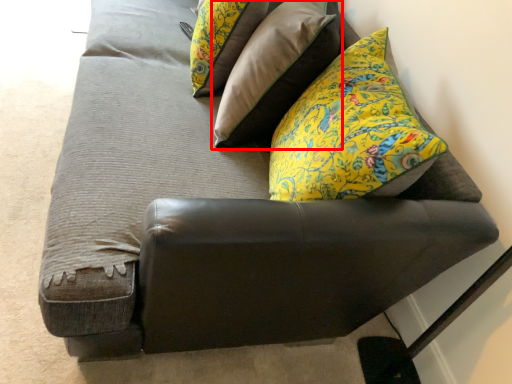
Question: From the image, what is the correct spatial relationship of pillow (annotated by the red box) in relation to pillow?

Choices:
 (A) right
 (B) left

Answer: (A)